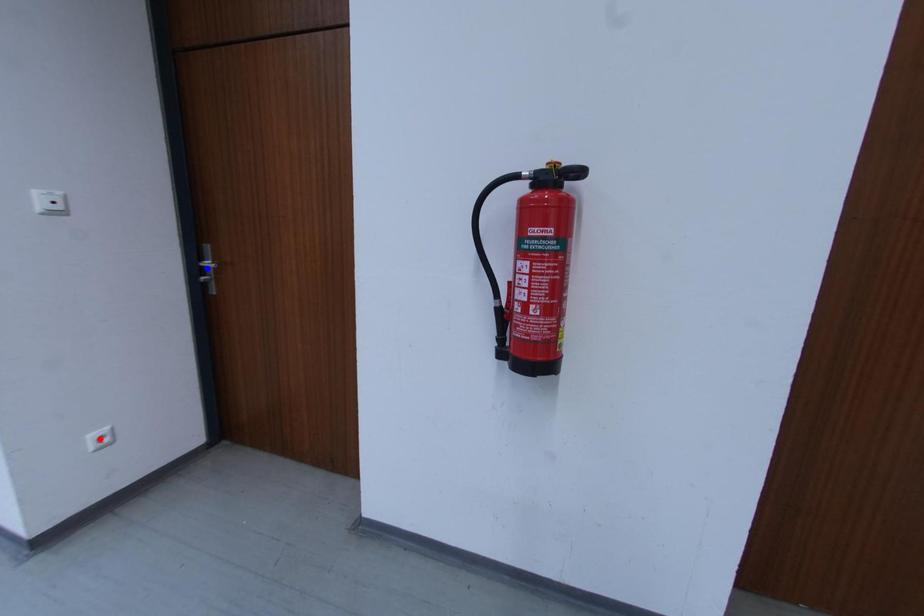
Question: In the image, two points are highlighted. Which point is nearer to the camera? Reply with the corresponding letter.

Choices:
 (A) blue point
 (B) red point

Answer: (B)